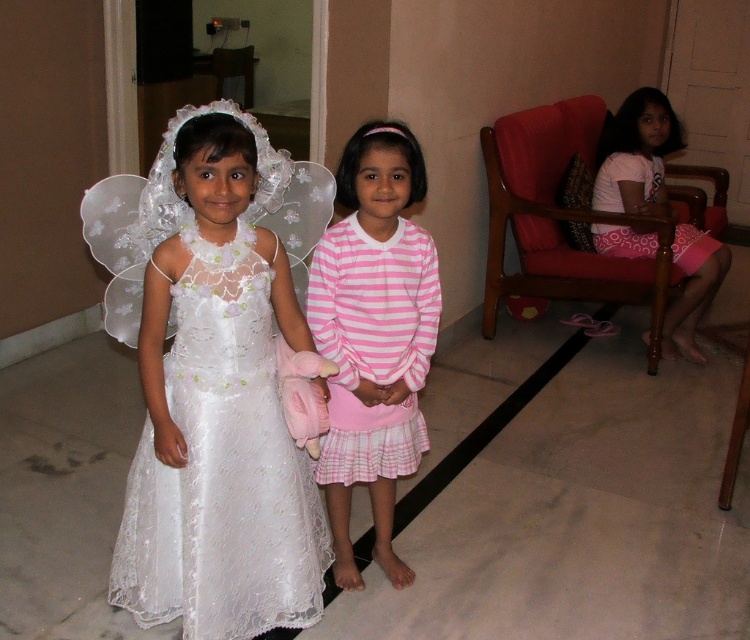
You are standing at the point labeled point (648, 97) and want to move to the point labeled point (153, 580). According to the scene description, which direction should you move to reach your destination?

You should move forward because point (153, 580) is in front of point (648, 97).

You are a photographer setting up for a family photo. You have two children wearing the white lace dress at left and the pink fabric dress at right. Which child should you position closer to the camera to ensure both appear the same size in the photo?

The white lace dress at left is smaller than the pink fabric dress at right, so you should position the child in the white lace dress at left closer to the camera to make them appear the same size as the other child.